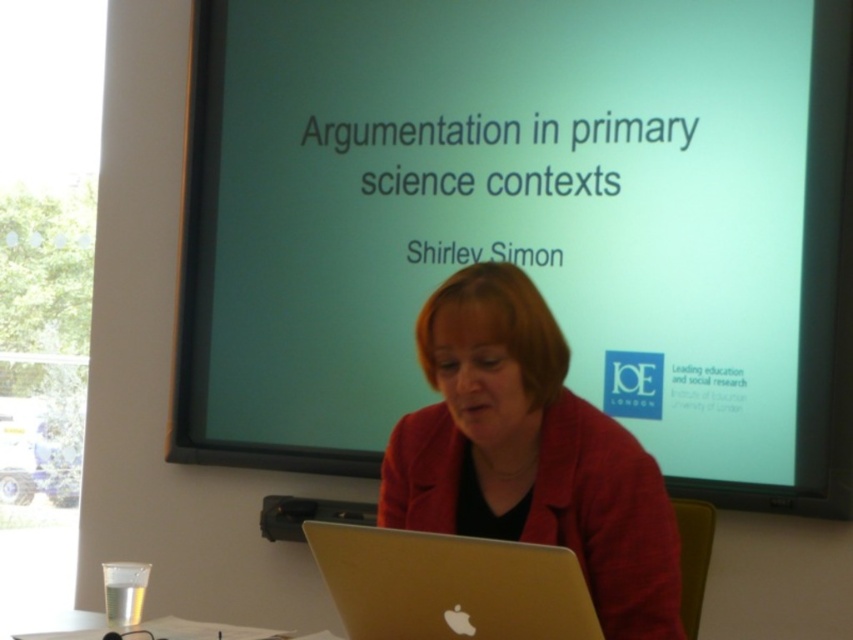
Is matte gold laptop at center taller than silver metallic laptop at center?

Indeed, matte gold laptop at center has a greater height compared to silver metallic laptop at center.

Does matte gold laptop at center have a lesser height compared to silver metallic laptop at center?

Incorrect, matte gold laptop at center's height does not fall short of silver metallic laptop at center's.

Does point (584, 422) lie in front of point (534, 620)?

No, (584, 422) is further to viewer.

Find the location of `matte gold laptop at center`. matte gold laptop at center is located at coordinates (529, 452).

Who is more forward, (x=645, y=250) or (x=310, y=518)?

Positioned in front is point (x=645, y=250).

Is green matte projection screen at upper center bigger than black plastic projector at center?

Yes, green matte projection screen at upper center is bigger than black plastic projector at center.

Is point (445, 262) positioned before point (335, 500)?

Yes, point (445, 262) is closer to viewer.

What are the coordinates of `green matte projection screen at upper center` in the screenshot? It's located at (521, 221).

Does matte gold laptop at center lie in front of black plastic projector at center?

Yes, matte gold laptop at center is in front of black plastic projector at center.

Does matte gold laptop at center appear over black plastic projector at center?

Yes.

The height and width of the screenshot is (640, 853). Identify the location of matte gold laptop at center. (529, 452).

Where is `matte gold laptop at center`? matte gold laptop at center is located at coordinates (529, 452).